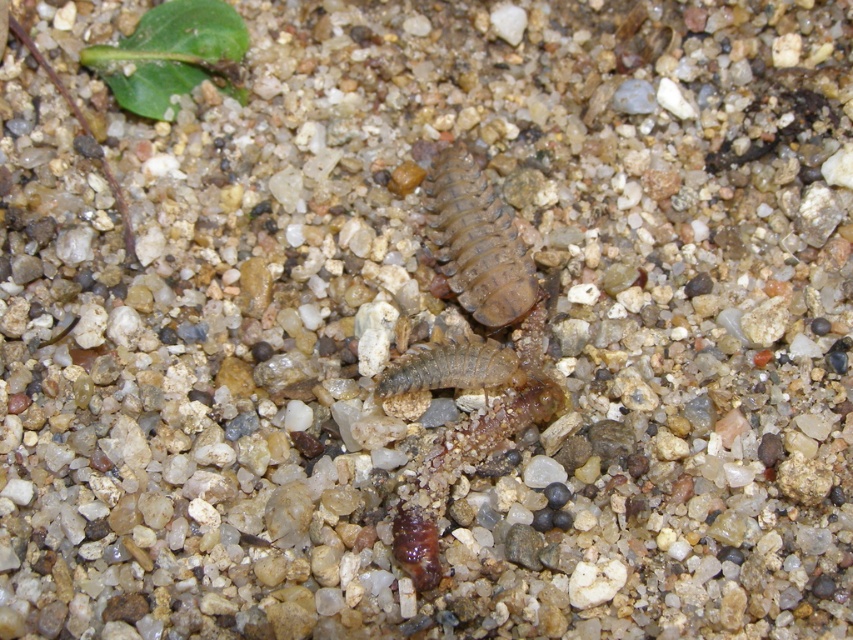
Can you confirm if brown fuzzy caterpillar at center is positioned above brown fuzzy caterpillar at lower center?

Indeed, brown fuzzy caterpillar at center is positioned over brown fuzzy caterpillar at lower center.

From the picture: Does brown fuzzy caterpillar at center have a greater height compared to brown fuzzy caterpillar at lower center?

In fact, brown fuzzy caterpillar at center may be shorter than brown fuzzy caterpillar at lower center.

Between point (488, 342) and point (398, 552), which one is positioned behind?

Positioned behind is point (488, 342).

Find the location of a particular element. brown fuzzy caterpillar at center is located at coordinates (450, 369).

Can you confirm if brown rough centipede at center is smaller than brown fuzzy caterpillar at center?

Actually, brown rough centipede at center might be larger than brown fuzzy caterpillar at center.

Who is more forward, (521,252) or (486,369)?

Positioned in front is point (486,369).

Between point (445, 152) and point (418, 364), which one is positioned behind?

Point (445, 152)

Where is `brown rough centipede at center`? This screenshot has width=853, height=640. brown rough centipede at center is located at coordinates (477, 241).

Is point (496, 276) closer to camera compared to point (410, 536)?

No, (496, 276) is further to viewer.

Can you confirm if brown rough centipede at center is wider than brown fuzzy caterpillar at lower center?

Yes.

Who is more distant from viewer, (432, 186) or (397, 545)?

The point (432, 186) is more distant.

You are a GUI agent. You are given a task and a screenshot of the screen. Output one action in this format:
    pyautogui.click(x=<x>, y=<y>)
    Task: Click on the brown rough centipede at center
    
    Given the screenshot: What is the action you would take?
    477,241